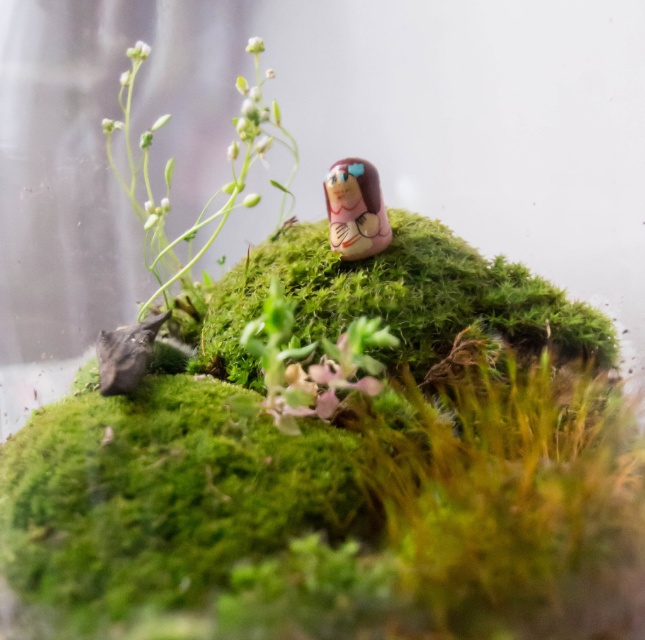
In the miniature terrarium scene, you notice a green matte plant at upper left and a matte pink figurine at center. Which object is wider?

The green matte plant at upper left is wider than the matte pink figurine at center.

You are designing a miniature garden and have a small space where you need to place both the green matte plant at upper left and the matte pink figurine at center. Based on their sizes, which object should you place first to ensure they both fit?

The green matte plant at upper left is bigger than the matte pink figurine at center, so you should place the green matte plant at upper left first to ensure both fit in the space.